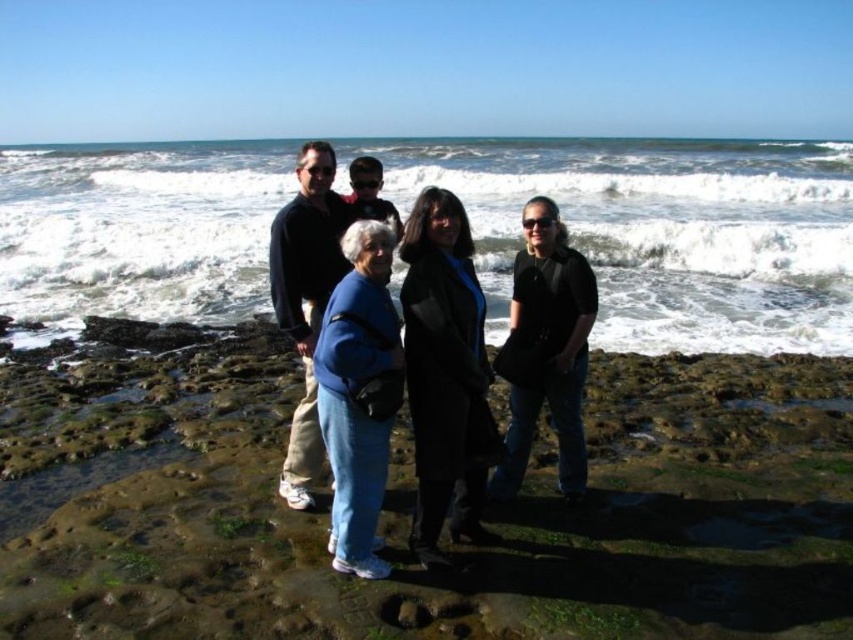
You are a photographer trying to capture a photo of the green mossy rocks at center and the blue fleece jacket at center. Which object should you zoom in on if you want to include both in the frame without cropping either?

The green mossy rocks at center are wider than the blue fleece jacket at center, so you should zoom in on the green mossy rocks at center to ensure both fit in the frame.

You are a photographer standing on the rocky shoreline and want to capture a photo that includes both the white frothy wave at upper center and the black matte coat at center. Since the wave is closer to you, how should you position your camera to ensure both are in focus?

Since the white frothy wave at upper center is closer to you than the black matte coat at center, you should focus on the wave first. This way, the black matte coat at center will naturally be in focus as it is behind the wave, ensuring both elements are sharp in the photo.

You are standing on the rocky shoreline and want to take a photo of the white frothy wave at upper center. If your camera can focus on objects up to 5 meters away, will you need to move closer to capture it clearly?

The white frothy wave at upper center is 5.61 meters from viewer, which is beyond the camera focus limit of 5 meters. Move closer to ensure clear focus.